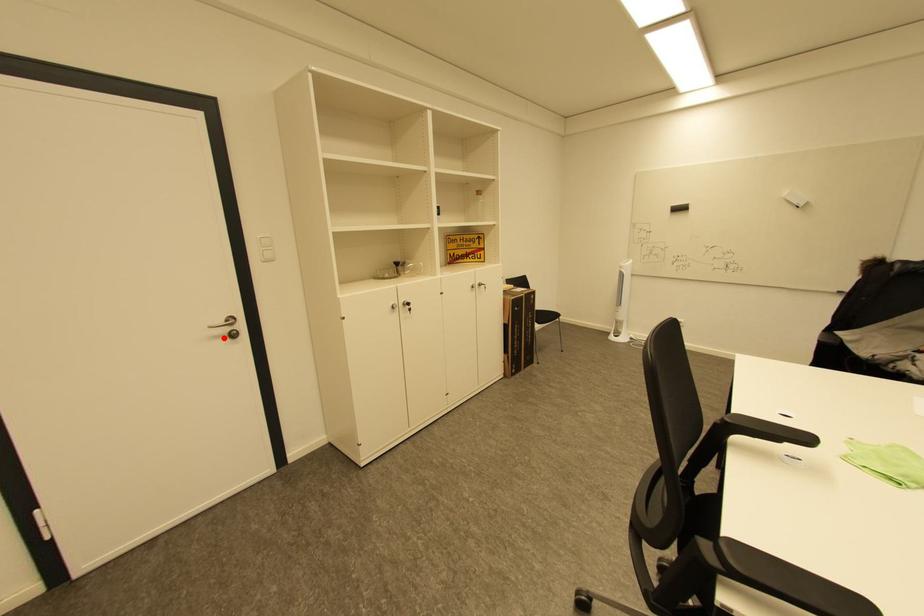
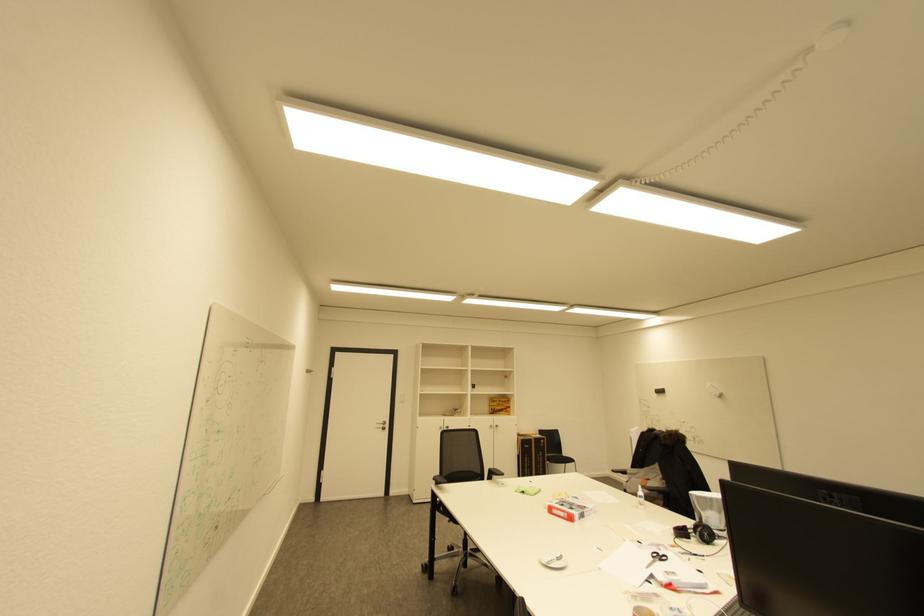
Question: I am providing you with two images of the same scene from different viewpoints. Image1 has a red point marked. In image2, the corresponding 3D location appears at what relative position? Reply with the corresponding letter.

Choices:
 (A) Closer
 (B) Farther

Answer: (B)